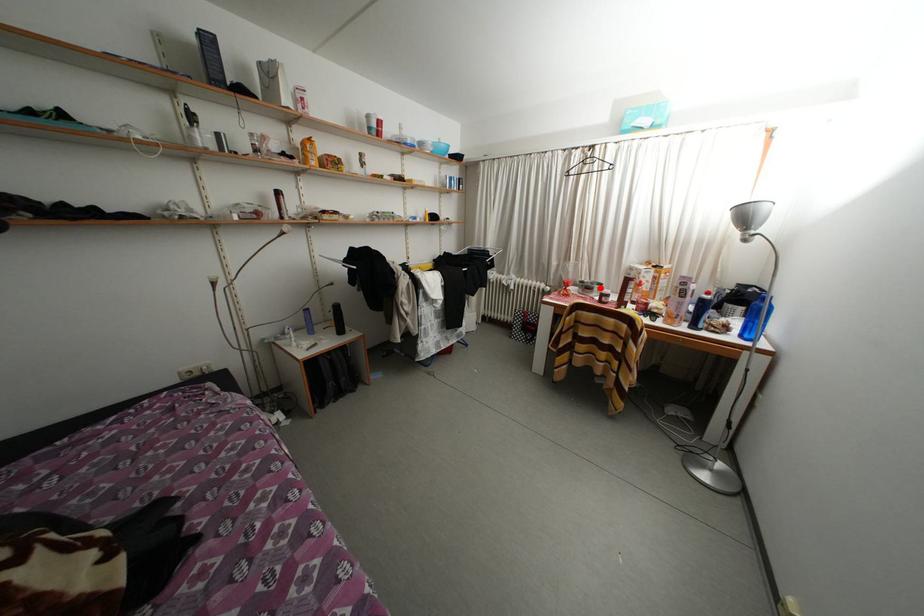
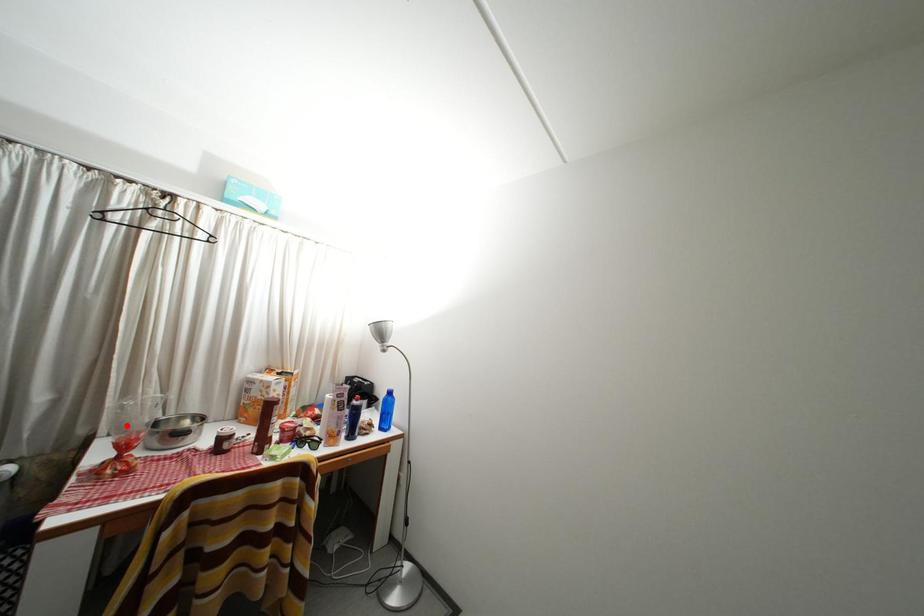
I am providing you with two images of the same scene from different viewpoints. A red point is marked on the first image and another point is marked on the second image. Do the highlighted points in image1 and image2 indicate the same real-world spot?

No